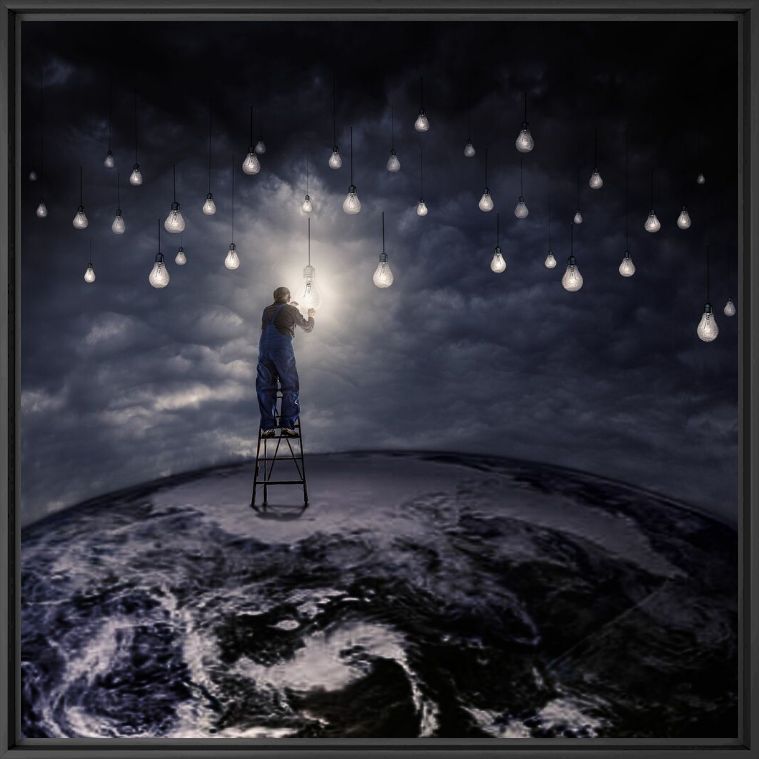
In order to click on light bulb in this screenshot , I will do `click(383, 266)`.